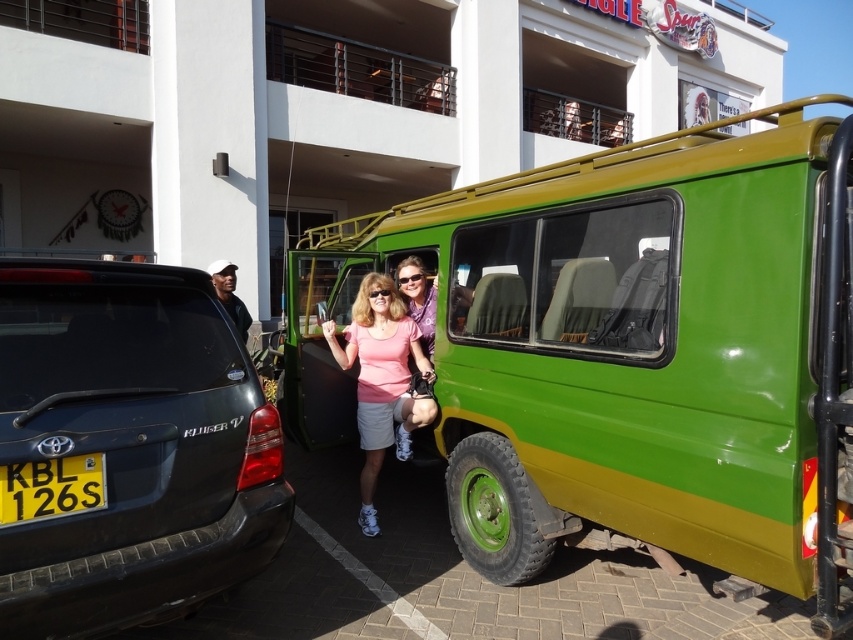
You are a delivery person who needs to park your van next to the pink matte shirt at center. However, there is a matte black suv at left blocking the path. Can you drive around the suv to reach the shirt?

The matte black suv at left is positioned over the pink matte shirt at center, meaning the suv is directly in front of the shirt. Therefore, you cannot drive around the suv to reach the pink matte shirt at center as it is blocking the path completely.

You are a delivery person trying to park your van next to the existing vehicles. The van you are driving is 2 meters tall. The parking spot has a height restriction of 1.8 meters. Can you safely park your van next to the matte black suv at left and the black plastic license plate at lower left without exceeding the height limit?

The matte black suv at left has a greater height compared to the black plastic license plate at lower left. Since the SUV is taller than the license plate, but the exact height of the SUV is not provided, we cannot determine if your van at 2 meters exceeds the 1.8 meter limit. Please check the SUV height or contact the parking authority for more information.